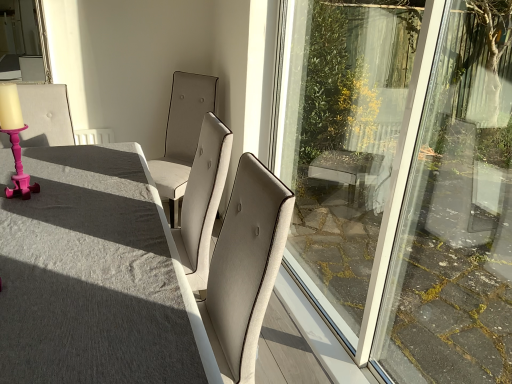
Question: In terms of width, does matte gray table at center look wider or thinner when compared to satin beige chair at center, which is the 2th chair in left-to-right order?

Choices:
 (A) wide
 (B) thin

Answer: (A)

Question: From a real-world perspective, is matte gray table at center above or below satin beige chair at center, which is the 2th chair in left-to-right order?

Choices:
 (A) below
 (B) above

Answer: (A)

Question: Which is nearer to the pink wood candle holder at left?

Choices:
 (A) satin beige chair at center, which is the 1th chair in right-to-left order
 (B) pink plastic candlestick at left, the second chair when ordered from right to left
 (C) matte gray table at center

Answer: (B)

Question: Which is nearer to the pink plastic candlestick at left, the second chair when ordered from right to left?

Choices:
 (A) satin beige chair at center, which is the 1th chair in right-to-left order
 (B) pink wood candle holder at left
 (C) matte gray table at center

Answer: (B)